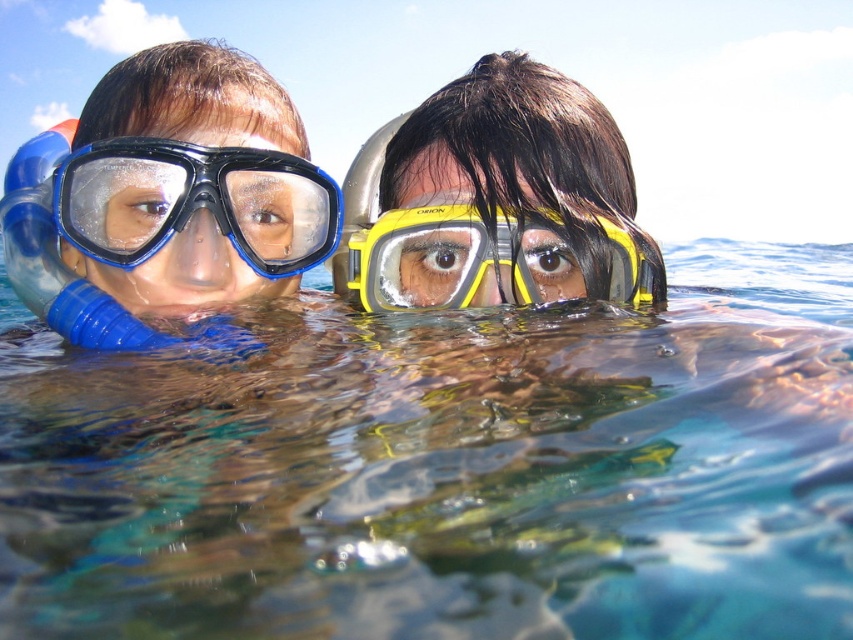
Question: Does clear blue water at center appear on the right side of blue tempered glass goggles at left?

Choices:
 (A) no
 (B) yes

Answer: (B)

Question: Based on their relative distances, which object is nearer to the yellow matte snorkel mask at center?

Choices:
 (A) clear blue water at center
 (B) blue tempered glass goggles at left

Answer: (A)

Question: Which point is closer to the camera?

Choices:
 (A) blue tempered glass goggles at left
 (B) yellow matte snorkel mask at center
 (C) clear blue water at center

Answer: (C)

Question: Which of the following is the closest to the observer?

Choices:
 (A) (242, 195)
 (B) (579, 435)

Answer: (B)

Question: Does clear blue water at center have a lesser width compared to blue tempered glass goggles at left?

Choices:
 (A) no
 (B) yes

Answer: (A)

Question: Is clear blue water at center to the left of yellow matte snorkel mask at center from the viewer's perspective?

Choices:
 (A) yes
 (B) no

Answer: (A)